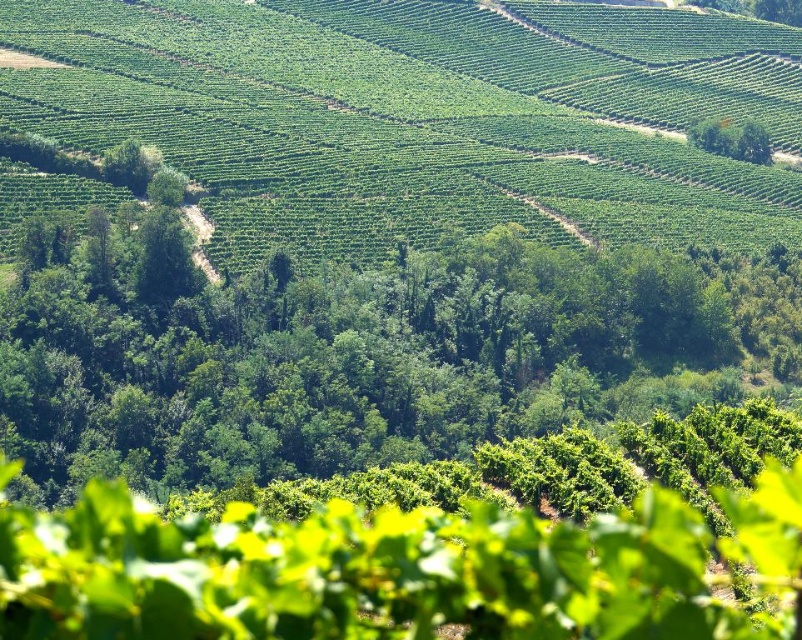
Question: Which object is farther from the camera taking this photo?

Choices:
 (A) green leafy tree at center
 (B) green leafy hillside at center
 (C) green leafy tree at upper right

Answer: (C)

Question: Is green leafy hillside at center wider than green leafy tree at center?

Choices:
 (A) yes
 (B) no

Answer: (A)

Question: Can you confirm if green leafy tree at center is positioned below green leafy tree at upper right?

Choices:
 (A) yes
 (B) no

Answer: (A)

Question: Which point appears farthest from the camera in this image?

Choices:
 (A) (225, 476)
 (B) (88, 136)
 (C) (731, 145)

Answer: (C)

Question: Does green leafy hillside at center appear under green leafy tree at center?

Choices:
 (A) yes
 (B) no

Answer: (B)

Question: Which point appears closest to the camera in this image?

Choices:
 (A) (748, 132)
 (B) (634, 276)
 (C) (430, 166)

Answer: (B)